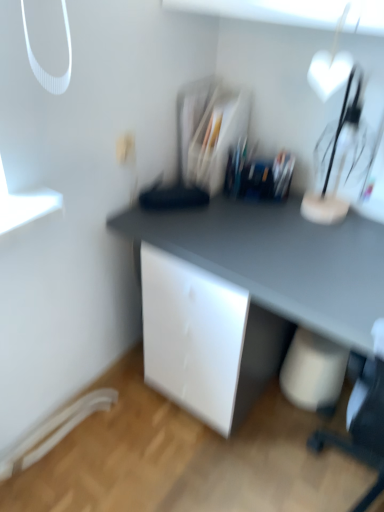
Question: From the image's perspective, is clear plastic organizer at center over matte gray desk at center?

Choices:
 (A) yes
 (B) no

Answer: (A)

Question: Can you confirm if clear plastic organizer at center is thinner than matte gray desk at center?

Choices:
 (A) yes
 (B) no

Answer: (A)

Question: Considering the relative sizes of clear plastic organizer at center and matte gray desk at center in the image provided, is clear plastic organizer at center taller than matte gray desk at center?

Choices:
 (A) no
 (B) yes

Answer: (A)

Question: Can you confirm if clear plastic organizer at center is bigger than matte gray desk at center?

Choices:
 (A) no
 (B) yes

Answer: (A)

Question: From a real-world perspective, is clear plastic organizer at center under matte gray desk at center?

Choices:
 (A) no
 (B) yes

Answer: (A)

Question: Is clear plastic organizer at center at the right side of matte gray desk at center?

Choices:
 (A) yes
 (B) no

Answer: (B)

Question: Does white glossy heart-shaped object at upper right have a lesser height compared to clear plastic organizer at center?

Choices:
 (A) no
 (B) yes

Answer: (A)

Question: Are white glossy heart-shaped object at upper right and clear plastic organizer at center located far from each other?

Choices:
 (A) no
 (B) yes

Answer: (A)

Question: Is white glossy heart-shaped object at upper right positioned behind clear plastic organizer at center?

Choices:
 (A) yes
 (B) no

Answer: (B)

Question: From a real-world perspective, is white glossy heart-shaped object at upper right positioned under clear plastic organizer at center based on gravity?

Choices:
 (A) no
 (B) yes

Answer: (A)

Question: Does white glossy heart-shaped object at upper right have a greater width compared to clear plastic organizer at center?

Choices:
 (A) yes
 (B) no

Answer: (B)

Question: Could you tell me if white glossy heart-shaped object at upper right is turned towards clear plastic organizer at center?

Choices:
 (A) yes
 (B) no

Answer: (B)

Question: Can you confirm if white matte electric outlet at upper center is smaller than white glossy heart-shaped object at upper right?

Choices:
 (A) yes
 (B) no

Answer: (A)